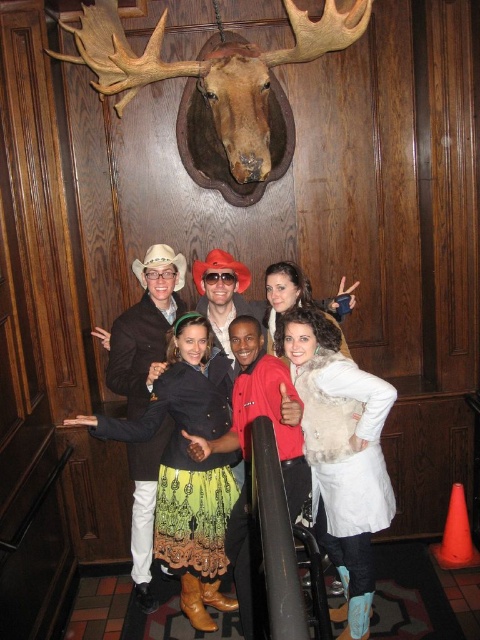
Looking at this image, you are organizing a photo shoot and need to ensure that the multicolored woven skirt at center and the brown polished wood reindeer head at upper center are visible in the frame. Based on their sizes, which object should you prioritize keeping centered to avoid cropping?

The brown polished wood reindeer head at upper center should be prioritized since it is wider than the multicolored woven skirt at center, making it more likely to be cropped if not centered properly.

You are a photographer trying to adjust the framing of the group photo. You notice the brown polished wood reindeer head at upper center and the green textured skirt at center. Which object is shorter in height?

The brown polished wood reindeer head at upper center is shorter than the green textured skirt at center.

Based on the scene description, which object is taller when comparing the multicolored woven skirt at center and the brown polished wood reindeer head at upper center?

The multicolored woven skirt at center is taller than the brown polished wood reindeer head at upper center according to the description.